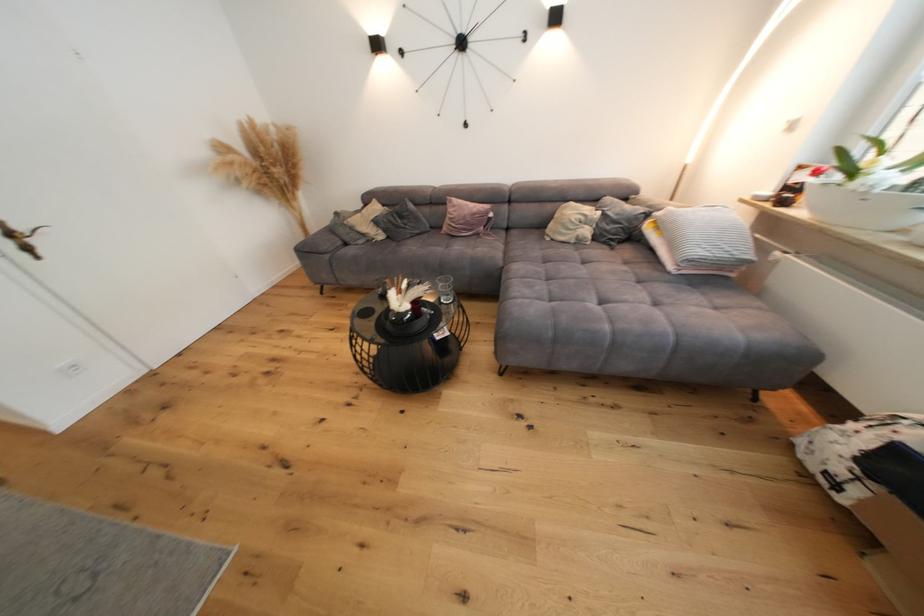
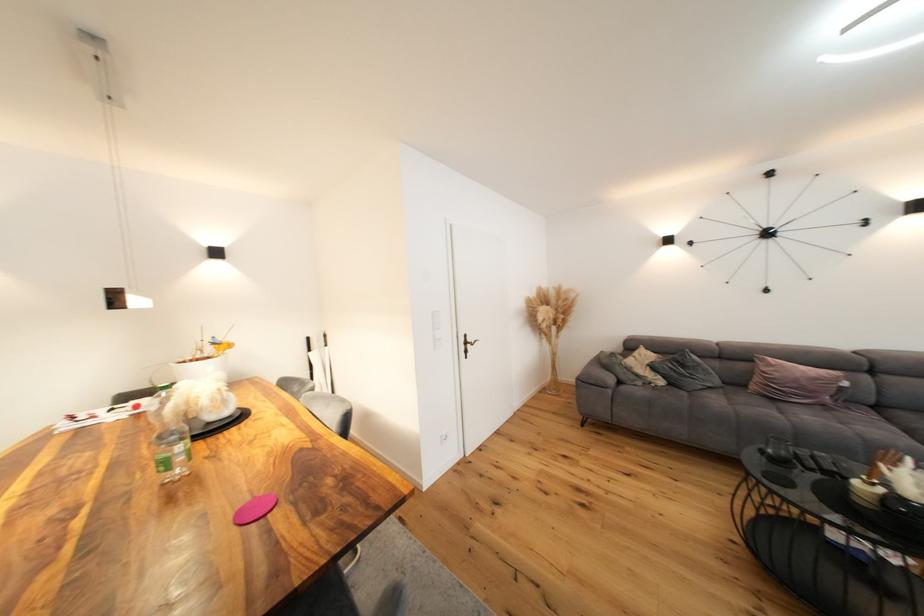
The point at (287, 207) is marked in the first image. Where is the corresponding point in the second image?

(548, 342)